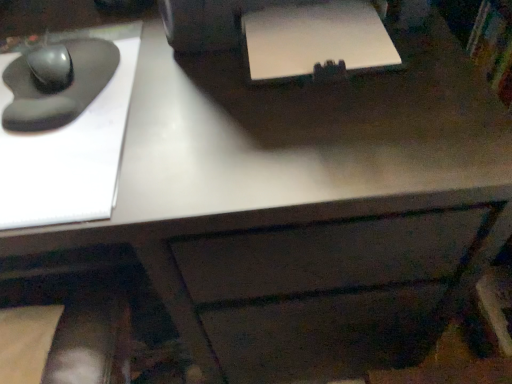
Question: Can you confirm if white matte printer at upper center is wider than matte black mouse at left, the first mouse when ordered from bottom to top?

Choices:
 (A) no
 (B) yes

Answer: (A)

Question: Can you confirm if white matte printer at upper center is thinner than matte black mouse at left, the first mouse when ordered from bottom to top?

Choices:
 (A) no
 (B) yes

Answer: (B)

Question: Does white matte printer at upper center have a larger size compared to matte black mouse at left, the second mouse positioned from the top?

Choices:
 (A) yes
 (B) no

Answer: (B)

Question: From the image's perspective, is white matte printer at upper center under matte black mouse at left, the first mouse when ordered from bottom to top?

Choices:
 (A) yes
 (B) no

Answer: (B)

Question: Can you confirm if white matte printer at upper center is positioned to the left of matte black mouse at left, the first mouse when ordered from bottom to top?

Choices:
 (A) yes
 (B) no

Answer: (B)

Question: From their relative heights in the image, would you say white matte printer at upper center is taller or shorter than matte black mouse at left, the second mouse positioned from the top?

Choices:
 (A) short
 (B) tall

Answer: (A)

Question: From a real-world perspective, relative to matte black mouse at left, the first mouse when ordered from bottom to top, is white matte printer at upper center vertically above or below?

Choices:
 (A) above
 (B) below

Answer: (A)

Question: From the image's perspective, is white matte printer at upper center located above or below matte black mouse at left, the first mouse when ordered from bottom to top?

Choices:
 (A) below
 (B) above

Answer: (B)

Question: Is white matte printer at upper center bigger or smaller than matte black mouse at left, the second mouse positioned from the top?

Choices:
 (A) big
 (B) small

Answer: (B)

Question: Does point [52, 91] appear closer or farther from the camera than point [39, 86]?

Choices:
 (A) farther
 (B) closer

Answer: (B)

Question: From the image's perspective, relative to matte black mouse at left, placed as the 1th mouse when sorted from top to bottom, is matte black mouse at left, the first mouse when ordered from bottom to top, above or below?

Choices:
 (A) above
 (B) below

Answer: (B)

Question: From their relative heights in the image, would you say matte black mouse at left, the first mouse when ordered from bottom to top, is taller or shorter than matte black mouse at left, positioned as the second mouse in bottom-to-top order?

Choices:
 (A) short
 (B) tall

Answer: (A)

Question: Is matte black mouse at left, the first mouse when ordered from bottom to top, inside or outside of matte black mouse at left, positioned as the second mouse in bottom-to-top order?

Choices:
 (A) inside
 (B) outside

Answer: (B)

Question: From a real-world perspective, is matte black mouse at left, positioned as the second mouse in bottom-to-top order, physically located above or below white matte printer at upper center?

Choices:
 (A) below
 (B) above

Answer: (A)

Question: Is matte black mouse at left, positioned as the second mouse in bottom-to-top order, bigger or smaller than white matte printer at upper center?

Choices:
 (A) big
 (B) small

Answer: (B)